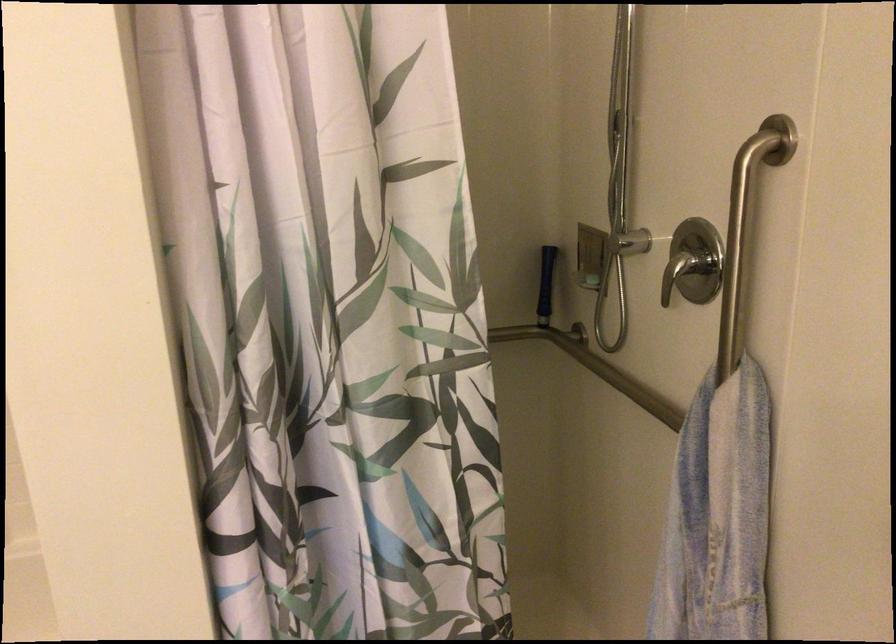
Where would you grasp the handheld shower head? Please return your answer as a coordinate pair (x, y).

(618, 184)